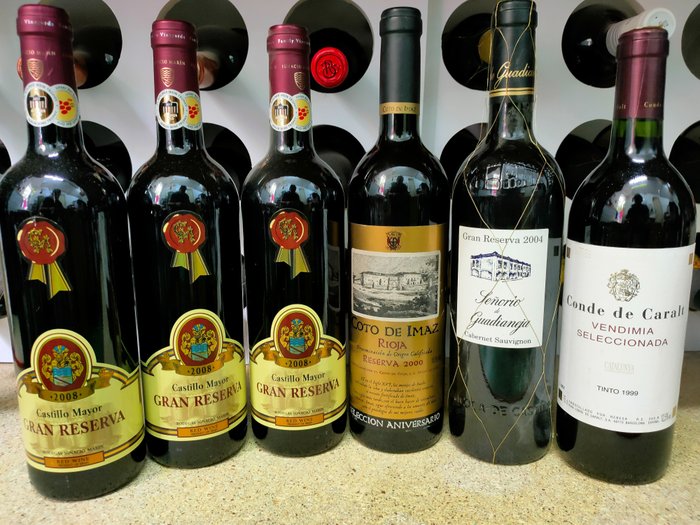
Where is `bottle`? The image size is (700, 525). bottle is located at coordinates pyautogui.click(x=412, y=438).